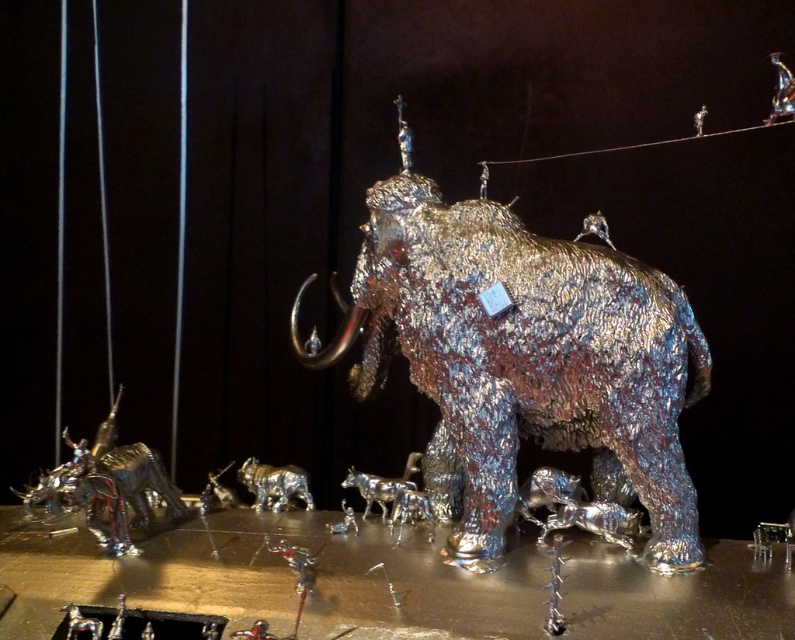
Question: Which point is farther to the camera?

Choices:
 (A) (318, 340)
 (B) (142, 493)

Answer: (A)

Question: Does shiny metallic elephant at center appear on the left side of shiny metallic dinosaur at lower left?

Choices:
 (A) yes
 (B) no

Answer: (B)

Question: Among these points, which one is nearest to the camera?

Choices:
 (A) (505, 451)
 (B) (138, 449)

Answer: (A)

Question: Is shiny metallic elephant at center to the right of shiny metallic dinosaur at lower left from the viewer's perspective?

Choices:
 (A) yes
 (B) no

Answer: (A)

Question: Is shiny metallic elephant at center further to the viewer compared to shiny metallic dinosaur at lower left?

Choices:
 (A) yes
 (B) no

Answer: (B)